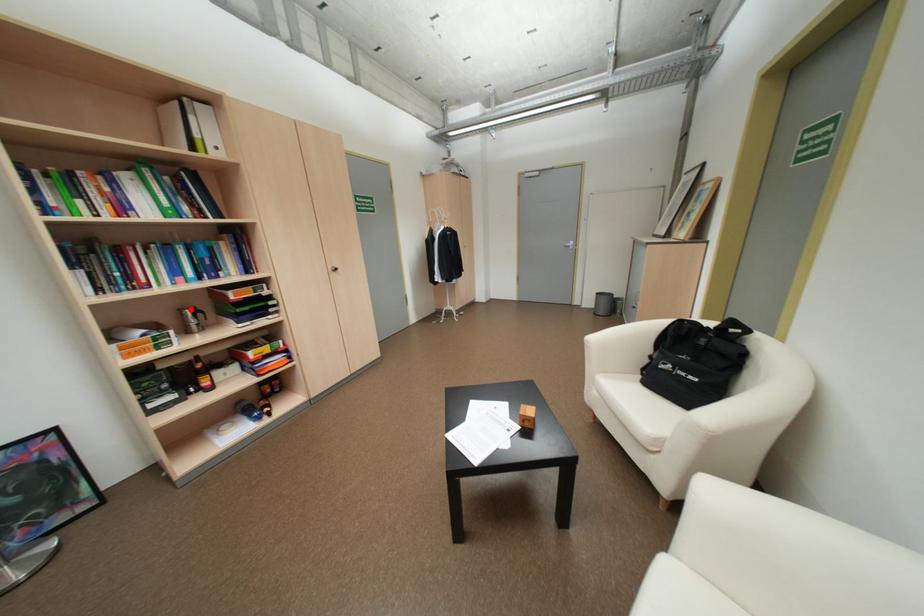
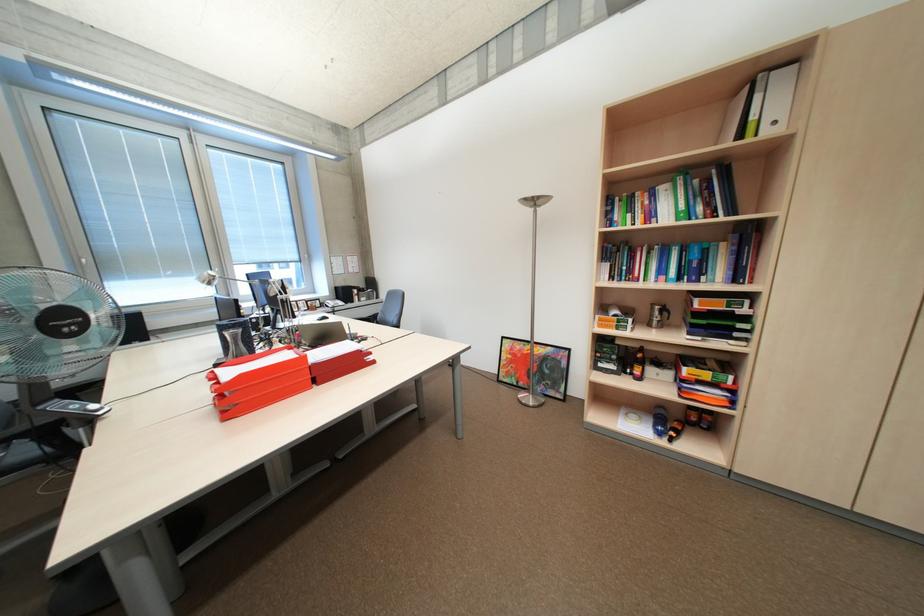
Find the pixel in the second image that matches the highlighted location in the first image.

(663, 304)